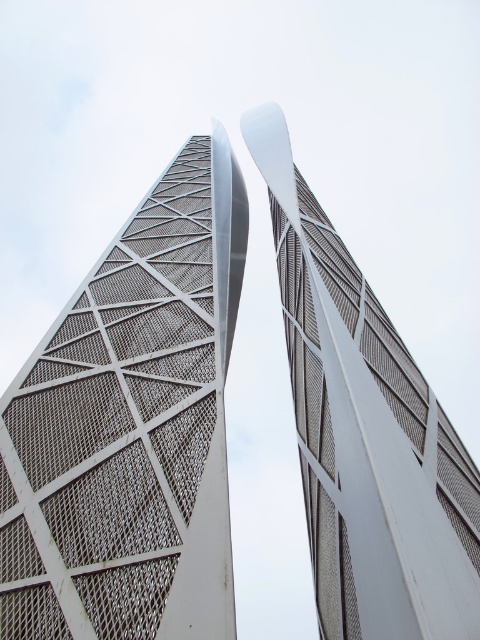
You are an architect planning to install a new light pole between the two white mesh towers. The light pole requires a minimum of 20 feet of space between its base and both towers to ensure safety. Based on the scene description, can you safely place the light pole between the white mesh tower at center and the white mesh tower at upper center?

The distance between the white mesh tower at center and the white mesh tower at upper center is 20.73 feet. Since the light pole requires a minimum of 20 feet of space from both towers, the 20.73 feet distance allows for safe placement as it meets the required clearance.